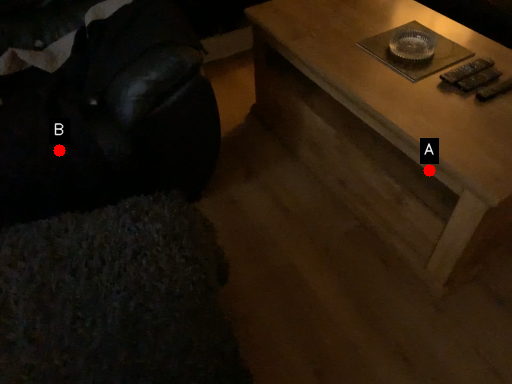
Question: Two points are circled on the image, labeled by A and B beside each circle. Which point is farther to the camera?

Choices:
 (A) A is further
 (B) B is further

Answer: (B)